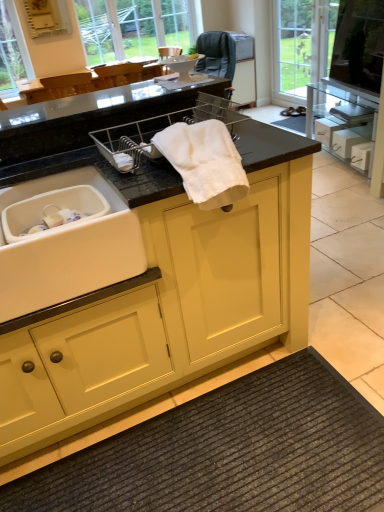
What do you see at coordinates (164, 313) in the screenshot? I see `matte yellow cabinet at center` at bounding box center [164, 313].

Describe the element at coordinates (204, 162) in the screenshot. I see `white cotton towel at center` at that location.

What do you see at coordinates (68, 249) in the screenshot?
I see `white matte sink at lower left` at bounding box center [68, 249].

This screenshot has width=384, height=512. Describe the element at coordinates (346, 142) in the screenshot. I see `white matte drawer at right` at that location.

What is the approximate width of transparent glass door at upper right?

It is 4.70 inches.

The height and width of the screenshot is (512, 384). Describe the element at coordinates (359, 44) in the screenshot. I see `transparent glass tv at upper right` at that location.

This screenshot has height=512, width=384. In order to click on transparent glass tv at upper right in this screenshot , I will do `click(359, 44)`.

What do you see at coordinates (230, 452) in the screenshot?
I see `dark gray textured bath mat at lower center` at bounding box center [230, 452].

Find the location of a particular element. The width and height of the screenshot is (384, 512). matte yellow cabinet at center is located at coordinates (164, 313).

Is transparent glass tv at upper right smaller than clear glass window at upper center?

Indeed, transparent glass tv at upper right has a smaller size compared to clear glass window at upper center.

Who is shorter, transparent glass tv at upper right or clear glass window at upper center?

With less height is transparent glass tv at upper right.

How distant is transparent glass tv at upper right from clear glass window at upper center?

transparent glass tv at upper right and clear glass window at upper center are 7.03 feet apart.

From a real-world perspective, which object stands above the other?

clear glass window at upper center is physically above.

Is transparent glass door at upper right surrounded by white matte drawer at right?

No, white matte drawer at right does not contain transparent glass door at upper right.

Does white matte drawer at right come in front of transparent glass door at upper right?

Yes, white matte drawer at right is in front of transparent glass door at upper right.

Considering the sizes of objects white matte drawer at right and transparent glass door at upper right in the image provided, who is bigger, white matte drawer at right or transparent glass door at upper right?

With larger size is transparent glass door at upper right.

Considering the positions of objects white matte drawer at right and transparent glass door at upper right in the image provided, who is more to the left, white matte drawer at right or transparent glass door at upper right?

transparent glass door at upper right is more to the left.

How much distance is there between transparent glass door at upper right and transparent glass tv at upper right?

A distance of 5.17 feet exists between transparent glass door at upper right and transparent glass tv at upper right.

Is transparent glass tv at upper right inside transparent glass door at upper right?

Definitely not — transparent glass tv at upper right is not inside transparent glass door at upper right.

Considering the positions of point (301, 89) and point (382, 18), is point (301, 89) closer or farther from the camera than point (382, 18)?

Clearly, point (301, 89) is more distant from the camera than point (382, 18).

Considering the sizes of objects transparent glass door at upper right and transparent glass tv at upper right in the image provided, who is shorter, transparent glass door at upper right or transparent glass tv at upper right?

Standing shorter between the two is transparent glass tv at upper right.

Which of these two, white matte sink at lower left or white matte drawer at right, is smaller?

Smaller between the two is white matte drawer at right.

From the image's perspective, between white matte sink at lower left and white matte drawer at right, which one is located above?

white matte drawer at right.

Is white matte sink at lower left closer to camera compared to white matte drawer at right?

Yes, it is in front of white matte drawer at right.

Which of these two, white matte sink at lower left or white matte drawer at right, stands shorter?

white matte drawer at right.

Which point is more forward, [118,21] or [349,139]?

Positioned in front is point [349,139].

How different are the orientations of clear glass window at upper center and white matte drawer at right in degrees?

100 degrees separate the facing orientations of clear glass window at upper center and white matte drawer at right.

Measure the distance from clear glass window at upper center to white matte drawer at right.

A distance of 2.54 meters exists between clear glass window at upper center and white matte drawer at right.

Is clear glass window at upper center to the left of white matte drawer at right from the viewer's perspective?

Correct, you'll find clear glass window at upper center to the left of white matte drawer at right.

Is the surface of white cotton towel at center in direct contact with white matte sink at lower left?

No, white cotton towel at center is not next to white matte sink at lower left.

From a real-world perspective, which is physically below, white cotton towel at center or white matte sink at lower left?

white matte sink at lower left is physically lower.

Is white cotton towel at center in front of or behind white matte sink at lower left in the image?

white cotton towel at center is positioned closer to the viewer than white matte sink at lower left.

Where is `window to the left of white matte drawer at right`? This screenshot has height=512, width=384. window to the left of white matte drawer at right is located at coordinates (136, 27).

Which is closer, (343,156) or (132,46)?

The point (343,156) is closer to the camera.

From the picture: Is white matte drawer at right situated inside clear glass window at upper center or outside?

white matte drawer at right is not inside clear glass window at upper center, it's outside.

What's the angular difference between white matte drawer at right and clear glass window at upper center's facing directions?

100 degrees separate the facing orientations of white matte drawer at right and clear glass window at upper center.

Locate an element on the screen. The width and height of the screenshot is (384, 512). window screen that is in front of the clear glass window at upper center is located at coordinates (359, 44).

This screenshot has height=512, width=384. In order to click on glass door that is behind the white matte drawer at right in this screenshot , I will do `click(298, 47)`.

Looking at the image, which one is located further to dark gray textured bath mat at lower center, white matte drawer at right or transparent glass door at upper right?

transparent glass door at upper right.

Based on the photo, based on their spatial positions, is white matte sink at lower left or matte yellow cabinet at center further from white matte drawer at right?

Based on the image, white matte sink at lower left appears to be further to white matte drawer at right.

When comparing their distances from white matte drawer at right, does transparent glass tv at upper right or transparent glass door at upper right seem further?

Among the two, transparent glass door at upper right is located further to white matte drawer at right.

From the image, which object appears to be farther from dark gray textured bath mat at lower center, clear glass window at upper center or white cotton towel at center?

clear glass window at upper center is positioned further to the anchor dark gray textured bath mat at lower center.

From the image, which object appears to be farther from transparent glass tv at upper right, white matte drawer at right or white matte sink at lower left?

Among the two, white matte sink at lower left is located further to transparent glass tv at upper right.

Looking at the image, which one is located closer to clear glass window at upper center, transparent glass tv at upper right or matte yellow cabinet at center?

transparent glass tv at upper right is closer to clear glass window at upper center.

When comparing their distances from matte yellow cabinet at center, does white matte drawer at right or clear glass window at upper center seem further?

Based on the image, clear glass window at upper center appears to be further to matte yellow cabinet at center.

From the image, which object appears to be farther from white matte sink at lower left, white matte drawer at right or dark gray textured bath mat at lower center?

white matte drawer at right is further to white matte sink at lower left.

Image resolution: width=384 pixels, height=512 pixels. I want to click on drawer located between clear glass window at upper center and transparent glass tv at upper right in the left-right direction, so click(346, 142).

Locate an element on the screen. Image resolution: width=384 pixels, height=512 pixels. drawer between dark gray textured bath mat at lower center and transparent glass door at upper right along the z-axis is located at coordinates (346, 142).

At what (x,y) coordinates should I click in order to perform the action: click on glass door between dark gray textured bath mat at lower center and clear glass window at upper center along the z-axis. Please return your answer as a coordinate pair (x, y). Image resolution: width=384 pixels, height=512 pixels. Looking at the image, I should click on (298, 47).

The image size is (384, 512). Identify the location of bath towel located between matte yellow cabinet at center and transparent glass tv at upper right in the depth direction. (204, 162).